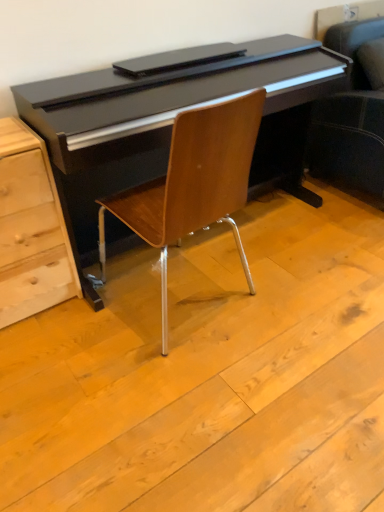
Question: From their relative heights in the image, would you say light wood chest of drawers at lower left is taller or shorter than woodenchair at center?

Choices:
 (A) short
 (B) tall

Answer: (A)

Question: Is point (8, 263) closer or farther from the camera than point (165, 251)?

Choices:
 (A) closer
 (B) farther

Answer: (A)

Question: Is light wood chest of drawers at lower left situated inside woodenchair at center or outside?

Choices:
 (A) inside
 (B) outside

Answer: (B)

Question: Is woodenchair at center taller or shorter than light wood chest of drawers at lower left?

Choices:
 (A) short
 (B) tall

Answer: (B)

Question: In the image, is woodenchair at center positioned in front of or behind light wood chest of drawers at lower left?

Choices:
 (A) behind
 (B) front

Answer: (B)

Question: Based on their sizes in the image, would you say woodenchair at center is bigger or smaller than light wood chest of drawers at lower left?

Choices:
 (A) small
 (B) big

Answer: (B)

Question: Would you say woodenchair at center is to the left or to the right of light wood chest of drawers at lower left in the picture?

Choices:
 (A) right
 (B) left

Answer: (A)